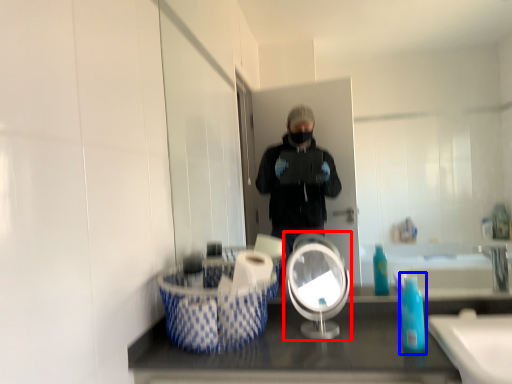
Question: Which point is closer to the camera, mirror (highlighted by a red box) or soap dispenser (highlighted by a blue box)?

Choices:
 (A) mirror
 (B) soap dispenser

Answer: (B)